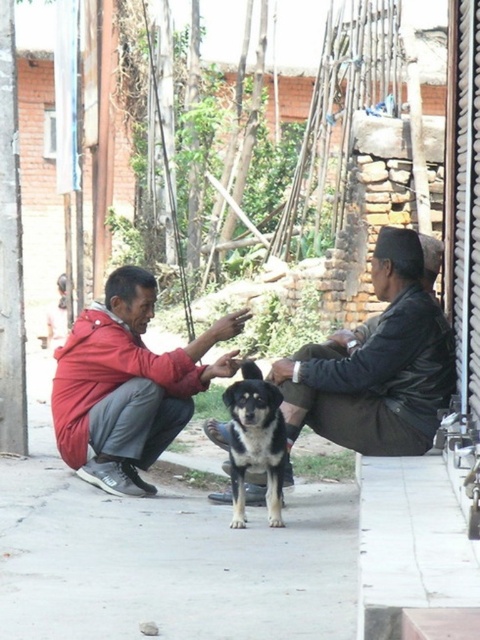
Is gray concrete pavement at center positioned before red matte jacket at center?

Yes.

Does point (41, 428) come closer to viewer compared to point (195, 385)?

No, (41, 428) is further to viewer.

Does point (180, 592) lie behind point (105, 300)?

No, it is in front of (105, 300).

Locate an element on the screen. This screenshot has width=480, height=640. gray concrete pavement at center is located at coordinates (165, 556).

Is gray concrete pavement at center shorter than leather jacket at center?

Indeed, gray concrete pavement at center has a lesser height compared to leather jacket at center.

Is gray concrete pavement at center closer to the viewer compared to leather jacket at center?

Yes.

At what (x,y) coordinates should I click in order to perform the action: click on gray concrete pavement at center. Please return your answer as a coordinate pair (x, y). This screenshot has height=640, width=480. Looking at the image, I should click on (165, 556).

Identify the location of gray concrete pavement at center. The width and height of the screenshot is (480, 640). (165, 556).

Is red matte jacket at center wider than black and brown fur dog at center?

Yes, red matte jacket at center is wider than black and brown fur dog at center.

Does red matte jacket at center appear under black and brown fur dog at center?

No.

Where is `red matte jacket at center`? Image resolution: width=480 pixels, height=640 pixels. red matte jacket at center is located at coordinates (128, 385).

Where is `red matte jacket at center`? red matte jacket at center is located at coordinates (128, 385).